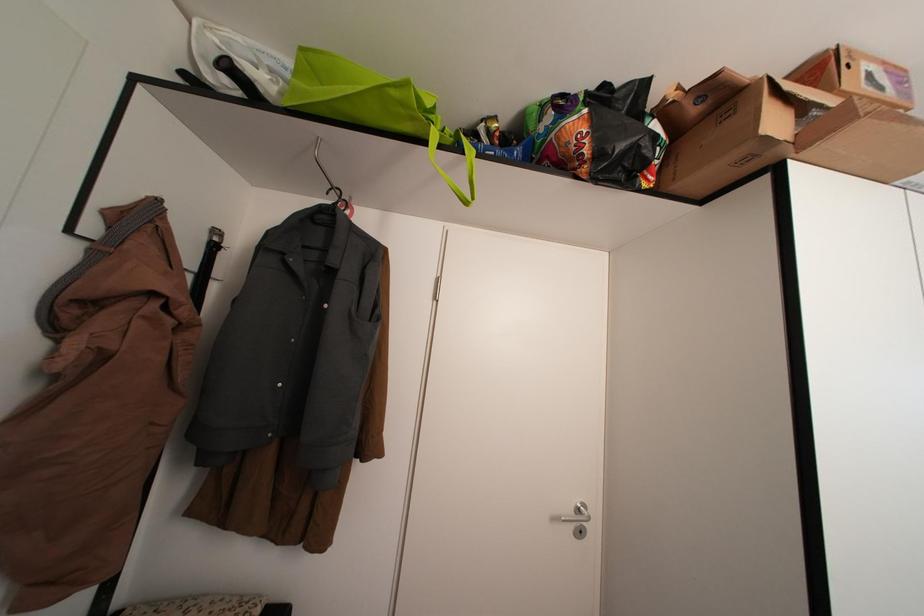
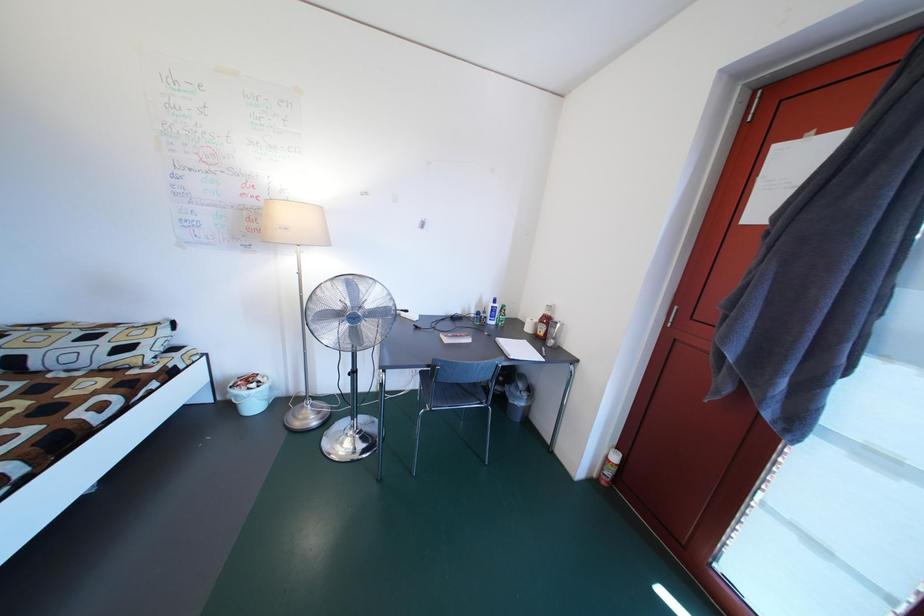
Question: In a continuous first-person perspective shot, in which direction is the camera moving?

Choices:
 (A) Left
 (B) Right
 (C) Forward
 (D) Backward

Answer: (B)